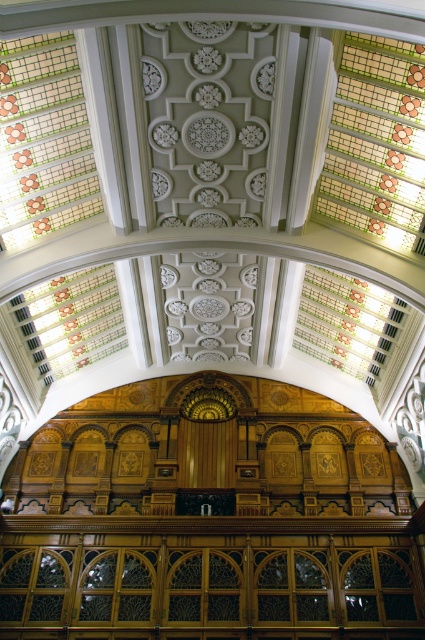
You are an interior designer assessing the symmetry of the building. You notice two stained glass windows, the stained glass window at upper center and the stained glass window at upper left. Which of these two windows has a greater width?

The stained glass window at upper center has a greater width than the stained glass window at upper left.

You are standing in the grand building and want to look through the clear glass window at center. Where should you look to find it?

The clear glass window at center is located at the point with coordinates 0.925 on the x axis and 0.496 on the y axis.